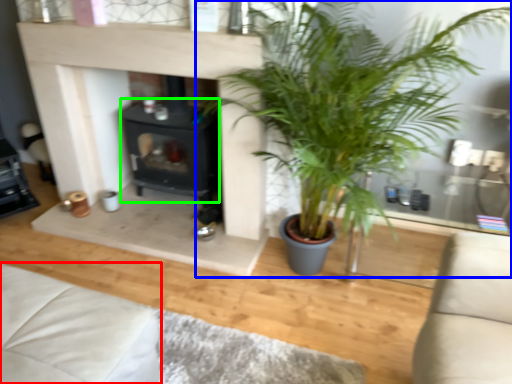
Question: Which object is the farthest from couch (highlighted by a red box)? Choose among these: houseplant (highlighted by a blue box) or fireplace (highlighted by a green box).

Choices:
 (A) houseplant
 (B) fireplace

Answer: (B)